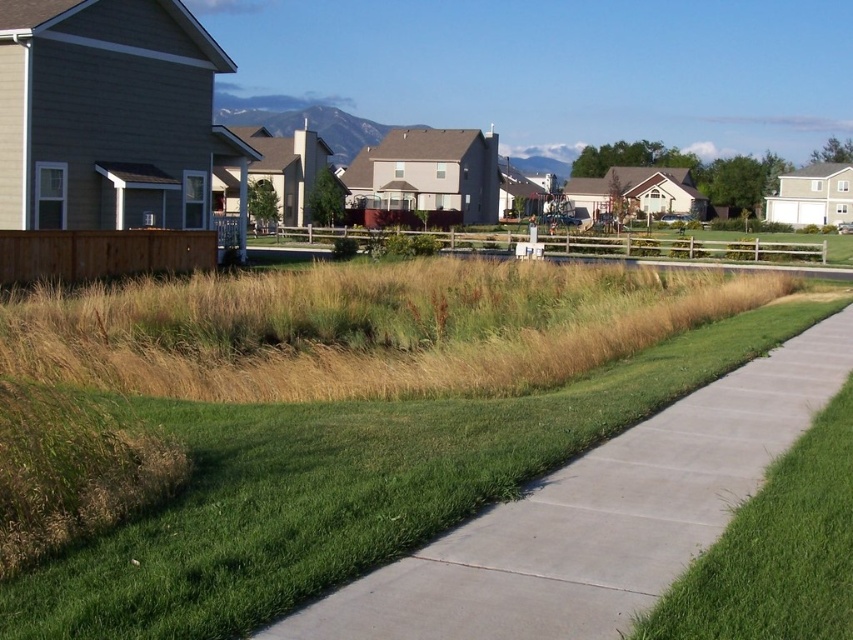
Can you confirm if green grass at center is smaller than green grass at lower right?

No, green grass at center is not smaller than green grass at lower right.

Between green grass at center and green grass at lower right, which one appears on the left side from the viewer's perspective?

green grass at center is more to the left.

Find the location of `green grass at center`. green grass at center is located at coordinates (344, 486).

This screenshot has height=640, width=853. Find the location of `green grass at center`. green grass at center is located at coordinates (344, 486).